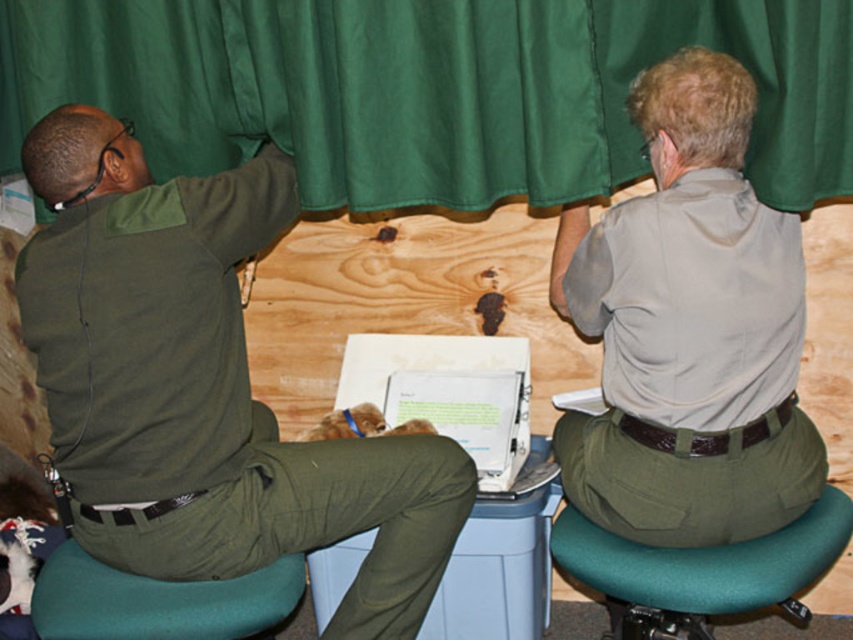
Question: Can you confirm if green matte uniform at left is positioned to the right of green fabric bar stool at lower right?

Choices:
 (A) no
 (B) yes

Answer: (A)

Question: Which point is closer to the camera?

Choices:
 (A) green fabric curtain at upper center
 (B) teal fabric bar stool at lower left

Answer: (A)

Question: Which of these objects is positioned farthest from the matte khaki shirt at upper right?

Choices:
 (A) green fabric bar stool at lower right
 (B) green fabric curtain at upper center
 (C) green matte uniform at left
 (D) teal fabric bar stool at lower left

Answer: (D)

Question: Is green fabric bar stool at lower right in front of teal fabric bar stool at lower left?

Choices:
 (A) no
 (B) yes

Answer: (B)

Question: Does green matte uniform at left appear on the right side of matte khaki shirt at upper right?

Choices:
 (A) yes
 (B) no

Answer: (B)

Question: Considering the real-world distances, which object is closest to the matte khaki shirt at upper right?

Choices:
 (A) green fabric bar stool at lower right
 (B) green fabric curtain at upper center
 (C) green matte uniform at left

Answer: (A)